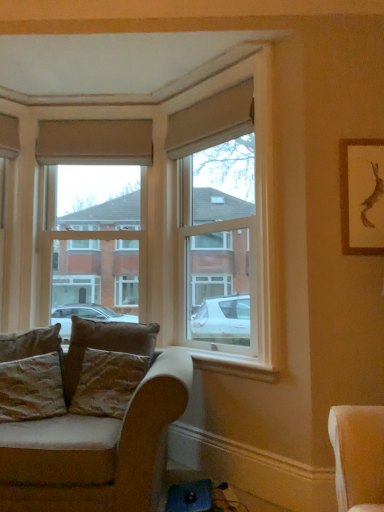
This screenshot has width=384, height=512. Describe the element at coordinates (98, 434) in the screenshot. I see `velvet beige couch at lower left` at that location.

What do you see at coordinates (216, 213) in the screenshot?
I see `clear glass window at center, the 1th window from the right` at bounding box center [216, 213].

At what (x,y) coordinates should I click in order to perform the action: click on clear glass window at center, arranged as the 2th window when viewed from the right. Please return your answer as a coordinate pair (x, y). The image size is (384, 512). Looking at the image, I should click on (94, 214).

Where is `white painted wood at lower right`? The image size is (384, 512). white painted wood at lower right is located at coordinates (233, 365).

This screenshot has width=384, height=512. I want to click on velvet beige couch at lower left, so click(98, 434).

Considering the sizes of objects beige fabric curtain at upper center, acting as the first curtain starting from the back, and clear glass window at center, the 1th window from the right, in the image provided, who is shorter, beige fabric curtain at upper center, acting as the first curtain starting from the back, or clear glass window at center, the 1th window from the right,?

beige fabric curtain at upper center, acting as the first curtain starting from the back.

Is there a large distance between beige fabric curtain at upper center, arranged as the second curtain when viewed from the right, and clear glass window at center, the 1th window from the right?

They are positioned close to each other.

From a real-world perspective, is beige fabric curtain at upper center, arranged as the second curtain when viewed from the right, over clear glass window at center, which appears as the second window when viewed from the left?

Yes, from a real-world perspective, beige fabric curtain at upper center, arranged as the second curtain when viewed from the right, is over clear glass window at center, which appears as the second window when viewed from the left

Considering their positions, is white painted wood at lower right located in front of or behind brown velvety pillow at lower left, which is the second pillow from left to right?

In the image, white painted wood at lower right appears in front of brown velvety pillow at lower left, which is the second pillow from left to right.

Who is taller, white painted wood at lower right or brown velvety pillow at lower left, which appears as the second pillow when viewed from the right?

brown velvety pillow at lower left, which appears as the second pillow when viewed from the right, is taller.

Measure the distance between white painted wood at lower right and brown velvety pillow at lower left, which is the second pillow from left to right.

white painted wood at lower right and brown velvety pillow at lower left, which is the second pillow from left to right, are 56.02 centimeters apart.

Which object is positioned more to the left, clear glass window at center, which appears as the second window when viewed from the left, or beige fabric curtain at upper center, arranged as the second curtain when viewed from the right?

Positioned to the left is beige fabric curtain at upper center, arranged as the second curtain when viewed from the right.

From the image's perspective, starting from the clear glass window at center, which appears as the second window when viewed from the left, which curtain is the 1st one above? Please provide its 2D coordinates.

[(95, 142)]

Measure the distance between clear glass window at center, the 1th window from the right, and beige fabric curtain at upper center, the first curtain viewed from the left.

clear glass window at center, the 1th window from the right, and beige fabric curtain at upper center, the first curtain viewed from the left, are 27.99 inches apart.

Could you tell me if clear glass window at center, the 1th window from the right, is facing beige fabric curtain at upper center, arranged as the second curtain when viewed from the right?

No, clear glass window at center, the 1th window from the right, does not turn towards beige fabric curtain at upper center, arranged as the second curtain when viewed from the right.

From a real-world perspective, is clear glass window at center, which appears as the second window when viewed from the left, positioned above or below brown velvety pillow at lower left, which appears as the second pillow when viewed from the right?

In terms of real-world spatial position, clear glass window at center, which appears as the second window when viewed from the left, is above brown velvety pillow at lower left, which appears as the second pillow when viewed from the right.

Considering the positions of objects clear glass window at center, which appears as the second window when viewed from the left, and brown velvety pillow at lower left, which appears as the second pillow when viewed from the right, in the image provided, who is behind, clear glass window at center, which appears as the second window when viewed from the left, or brown velvety pillow at lower left, which appears as the second pillow when viewed from the right,?

brown velvety pillow at lower left, which appears as the second pillow when viewed from the right.

Is clear glass window at center, which appears as the second window when viewed from the left, surrounding brown velvety pillow at lower left, which is the second pillow from left to right?

Actually, brown velvety pillow at lower left, which is the second pillow from left to right, is outside clear glass window at center, which appears as the second window when viewed from the left.

Which of these two, clear glass window at center, the 1th window from the right, or brown velvety pillow at lower left, which is the second pillow from left to right, is wider?

With larger width is clear glass window at center, the 1th window from the right.

Considering the positions of points (120, 379) and (214, 356), is point (120, 379) farther from camera compared to point (214, 356)?

No, it is in front of (214, 356).

Which object is closer to the camera taking this photo, velvet brown pillow at lower left, the 1th pillow from the right, or white painted wood at lower right?

velvet brown pillow at lower left, the 1th pillow from the right, is more forward.

Is velvet brown pillow at lower left, the 1th pillow from the right, directly adjacent to white painted wood at lower right?

No, velvet brown pillow at lower left, the 1th pillow from the right, is not touching white painted wood at lower right.

From a real-world perspective, is velvet brown pillow at lower left, the 1th pillow from the right, physically located above or below white painted wood at lower right?

From a real-world perspective, velvet brown pillow at lower left, the 1th pillow from the right, is physically below white painted wood at lower right.

From the image's perspective, which one is positioned higher, wooden framed artwork at upper right or clear glass window at center, arranged as the 2th window when viewed from the right?

wooden framed artwork at upper right, from the image's perspective.

Is wooden framed artwork at upper right at the left side of clear glass window at center, the 1th window from the left?

Incorrect, wooden framed artwork at upper right is not on the left side of clear glass window at center, the 1th window from the left.

Is wooden framed artwork at upper right looking in the opposite direction of clear glass window at center, arranged as the 2th window when viewed from the right?

No.

Does point (383, 191) lie in front of point (144, 298)?

That is True.

From a real-world perspective, is velvet brown pillow at lower left, the 1th pillow from the right, physically below beige fabric curtain at upper center, arranged as the second curtain when viewed from the right?

Yes.

Which of these two, velvet brown pillow at lower left, marked as the third pillow in a left-to-right arrangement, or beige fabric curtain at upper center, the first curtain viewed from the left, stands taller?

velvet brown pillow at lower left, marked as the third pillow in a left-to-right arrangement, is taller.

Does velvet brown pillow at lower left, the 1th pillow from the right, have a smaller size compared to beige fabric curtain at upper center, the 2th curtain in the front-to-back sequence?

No.

From the image's perspective, is velvet brown pillow at lower left, marked as the third pillow in a left-to-right arrangement, under beige fabric curtain at upper center, acting as the first curtain starting from the back?

Yes, from the image's perspective, velvet brown pillow at lower left, marked as the third pillow in a left-to-right arrangement, is below beige fabric curtain at upper center, acting as the first curtain starting from the back.

From the image's perspective, which curtain is the 1st one above the clear glass window at center, the 1th window from the right? Please provide its 2D coordinates.

[(95, 142)]

The height and width of the screenshot is (512, 384). What are the coordinates of `window sill below the brown velvety pillow at lower left, which appears as the second pillow when viewed from the right (from the image's perspective)` in the screenshot? It's located at (233, 365).

When comparing their distances from white fabric curtain at upper center, positioned as the first curtain in right-to-left order, does wooden framed artwork at upper right or beige fabric curtain at upper center, the 2th curtain in the front-to-back sequence, seem further?

wooden framed artwork at upper right lies further to white fabric curtain at upper center, positioned as the first curtain in right-to-left order, than the other object.

From the image, which object appears to be farther from white painted wood at lower right, white fabric curtain at upper center, acting as the 2th curtain starting from the back, or clear glass window at center, which appears as the second window when viewed from the left?

white fabric curtain at upper center, acting as the 2th curtain starting from the back, is further to white painted wood at lower right.

From the image, which object appears to be farther from brown velvety pillow at lower left, which appears as the second pillow when viewed from the right, clear glass window at center, the 1th window from the right, or wooden framed artwork at upper right?

wooden framed artwork at upper right lies further to brown velvety pillow at lower left, which appears as the second pillow when viewed from the right, than the other object.

Considering their positions, is velvet beige couch at lower left positioned further to velvet brown pillow at lower left, the 1th pillow from the right, than textured beige pillow at lower left, which is the first pillow from left to right?

velvet beige couch at lower left.

Looking at the image, which one is located further to velvet beige couch at lower left, textured beige pillow at lower left, positioned as the third pillow in right-to-left order, or brown velvety pillow at lower left, which appears as the second pillow when viewed from the right?

brown velvety pillow at lower left, which appears as the second pillow when viewed from the right, lies further to velvet beige couch at lower left than the other object.

Considering their positions, is velvet brown pillow at lower left, marked as the third pillow in a left-to-right arrangement, positioned closer to white fabric curtain at upper center, positioned as the first curtain in right-to-left order, than white painted wood at lower right?

white painted wood at lower right lies closer to white fabric curtain at upper center, positioned as the first curtain in right-to-left order, than the other object.

In the scene shown: Estimate the real-world distances between objects in this image. Which object is closer to white fabric curtain at upper center, which ranks as the 1th curtain in front-to-back order, velvet brown pillow at lower left, marked as the third pillow in a left-to-right arrangement, or brown velvety pillow at lower left, which is the second pillow from left to right?

Among the two, brown velvety pillow at lower left, which is the second pillow from left to right, is located nearer to white fabric curtain at upper center, which ranks as the 1th curtain in front-to-back order.

Looking at the image, which one is located closer to white fabric curtain at upper center, which ranks as the 1th curtain in front-to-back order, clear glass window at center, arranged as the 2th window when viewed from the right, or velvet brown pillow at lower left, the 1th pillow from the right?

clear glass window at center, arranged as the 2th window when viewed from the right, is closer to white fabric curtain at upper center, which ranks as the 1th curtain in front-to-back order.

Identify the location of window between clear glass window at center, arranged as the 2th window when viewed from the right, and wooden framed artwork at upper right, in the horizontal direction. (216, 213).

The width and height of the screenshot is (384, 512). Find the location of `window sill between clear glass window at center, the 1th window from the left, and velvet brown pillow at lower left, marked as the third pillow in a left-to-right arrangement, in the vertical direction`. window sill between clear glass window at center, the 1th window from the left, and velvet brown pillow at lower left, marked as the third pillow in a left-to-right arrangement, in the vertical direction is located at coordinates (233, 365).

I want to click on window sill between white fabric curtain at upper center, the 2th curtain viewed from the left, and velvet brown pillow at lower left, the 1th pillow from the right, vertically, so click(233, 365).

Find the location of a particular element. The width and height of the screenshot is (384, 512). curtain between beige fabric curtain at upper center, arranged as the second curtain when viewed from the right, and clear glass window at center, the 1th window from the right, in the horizontal direction is located at coordinates (211, 121).